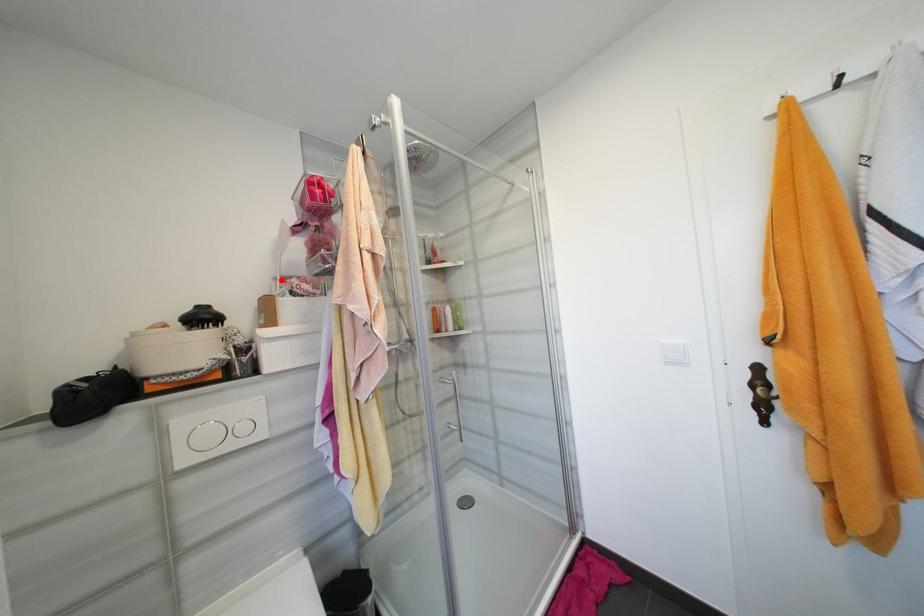
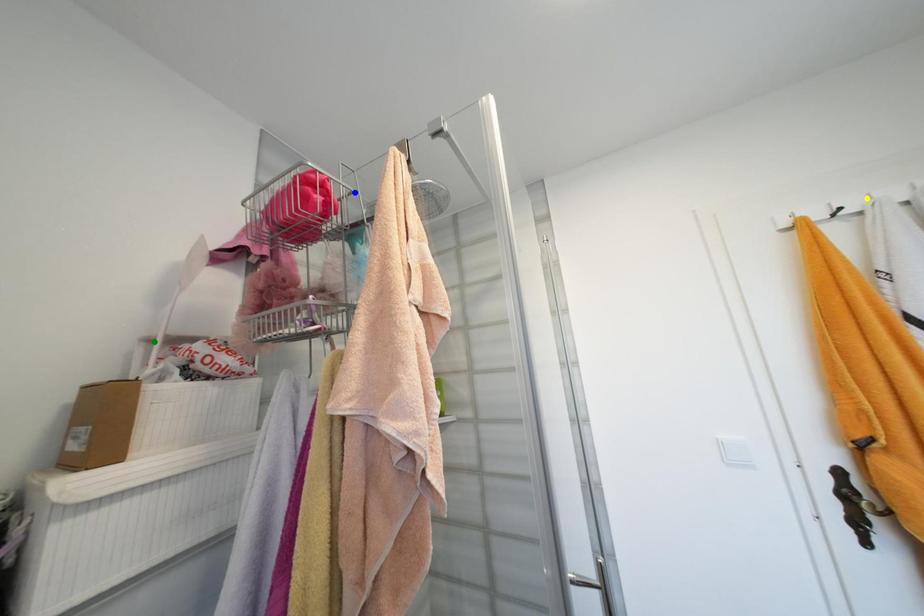
Question: I am providing you with two images of the same scene from different viewpoints. A red point is marked on the first image. You are given multiple points on the second image. In image 2, which mark is for the same physical point as the one in image 1?

Choices:
 (A) yellow point
 (B) green point
 (C) blue point

Answer: (B)